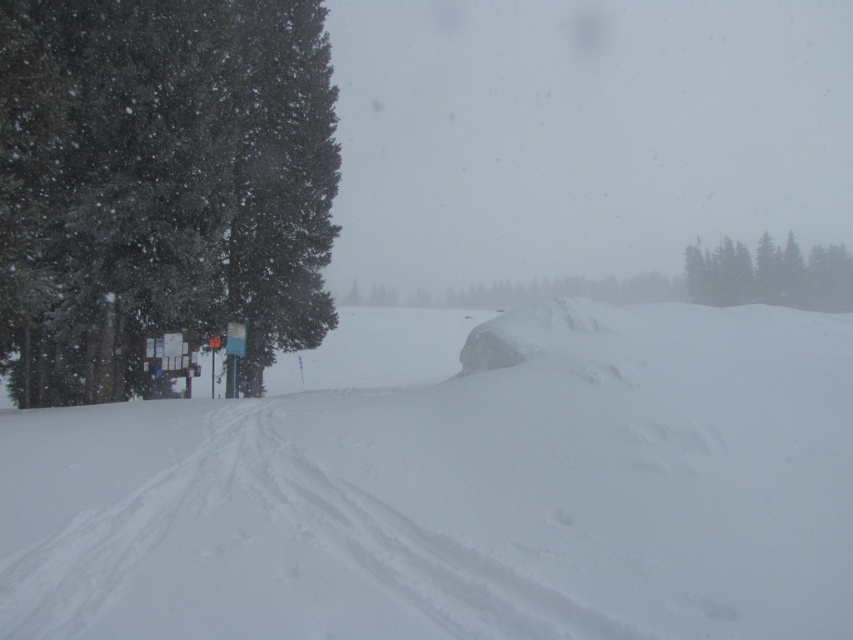
You are a hiker trying to navigate through the snowy landscape. You see the white powdery snow at center and the green textured trees at upper right. Which direction should you head towards to reach the trees?

You should head towards the right because the white powdery snow at center is to the left of green textured trees at upper right, so moving right from the snow will lead you towards the trees.